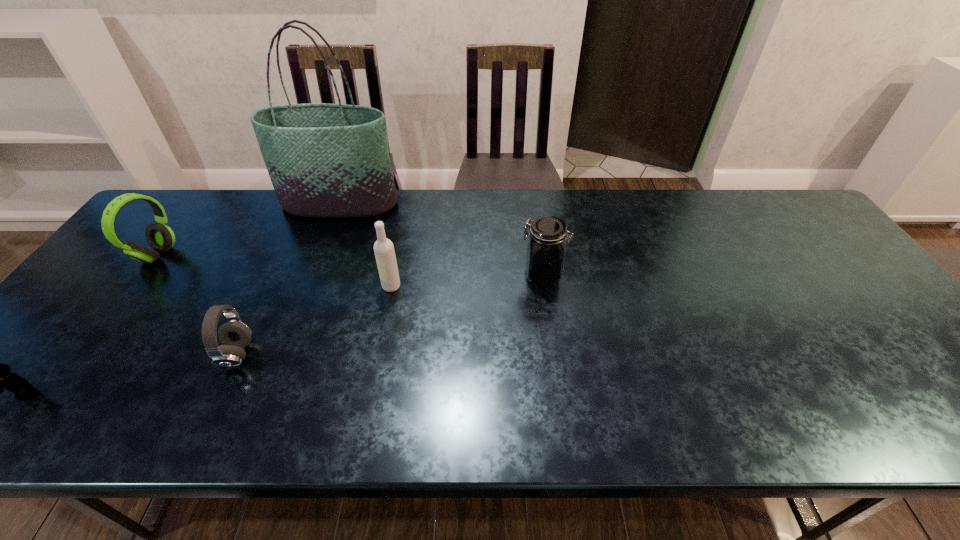
This screenshot has width=960, height=540. In order to click on vacant space situated on the left of the farthest object in this screenshot , I will do `click(185, 204)`.

The height and width of the screenshot is (540, 960). Identify the location of vacant space located 0.370m on the back of the vodka. (408, 199).

Image resolution: width=960 pixels, height=540 pixels. In order to click on free space located on the front of the left headset in this screenshot , I will do `click(118, 307)`.

This screenshot has width=960, height=540. I want to click on vacant space located 0.260m on the lid of the jar, so (425, 274).

You are a GUI agent. You are given a task and a screenshot of the screen. Output one action in this format:
    pyautogui.click(x=<x>, y=<y>)
    Task: Click on the free space located on the lid of the jar
    The height and width of the screenshot is (540, 960).
    Given the screenshot: What is the action you would take?
    502,274

Where is `vacant space located on the lid of the jar`? The image size is (960, 540). vacant space located on the lid of the jar is located at coordinates (377, 274).

This screenshot has height=540, width=960. Identify the location of vacant space situated 0.120m on the ear cups of the second nearest object. (306, 354).

Find the location of a particular element. object that is at the far edge is located at coordinates (324, 160).

Find the location of a particular element. The width and height of the screenshot is (960, 540). object located in the near edge section of the desktop is located at coordinates (0, 376).

I want to click on headset that is at the left edge, so tap(160, 237).